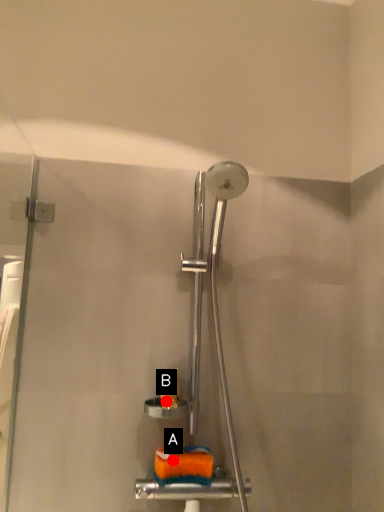
Question: Two points are circled on the image, labeled by A and B beside each circle. Which point is closer to the camera?

Choices:
 (A) A is closer
 (B) B is closer

Answer: (A)